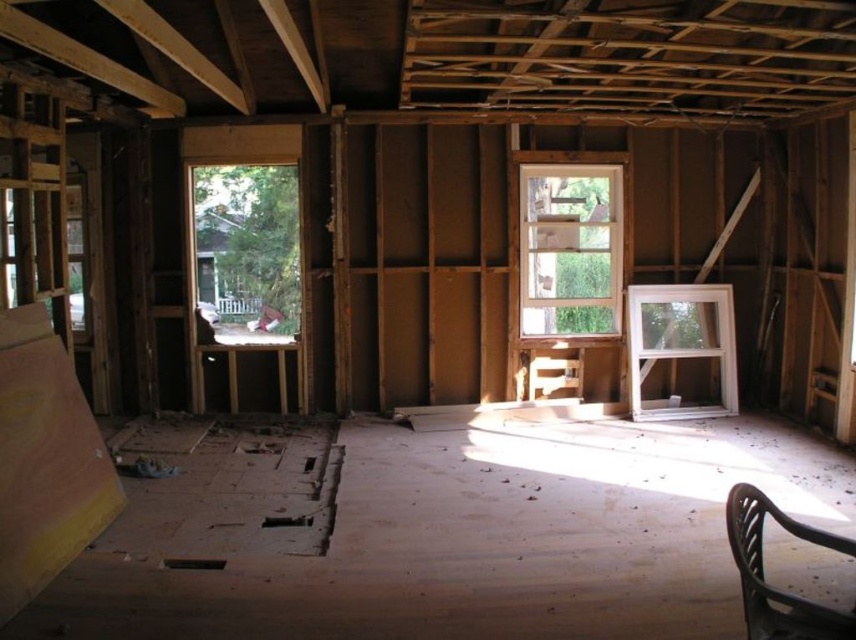
Is clear glass window at center closer to camera compared to white plastic window at right?

No, clear glass window at center is behind white plastic window at right.

Looking at this image, measure the distance from clear glass window at center to white plastic window at right.

clear glass window at center is 57.12 centimeters from white plastic window at right.

At what (x,y) coordinates should I click in order to perform the action: click on clear glass window at center. Please return your answer as a coordinate pair (x, y). The height and width of the screenshot is (640, 856). Looking at the image, I should click on (x=569, y=250).